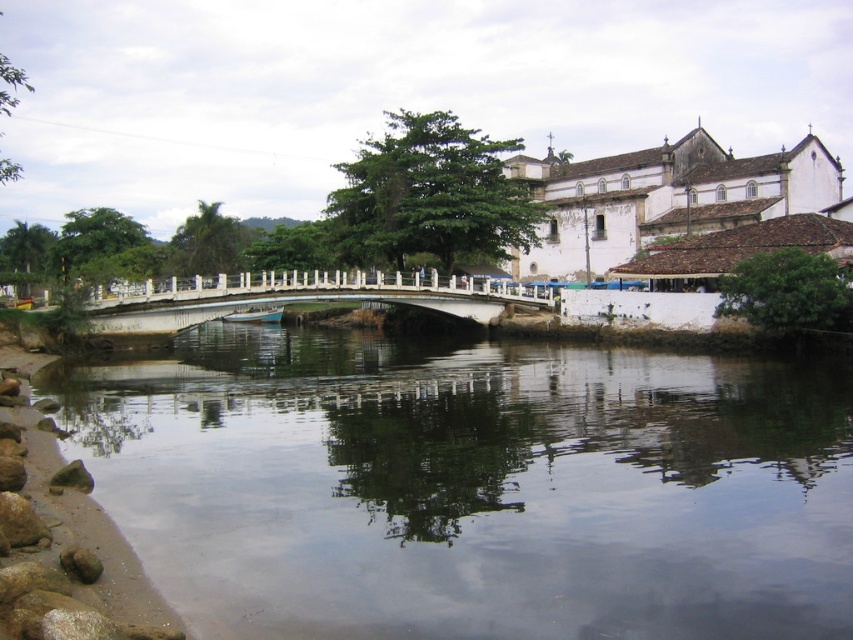
Describe the element at coordinates (473, 486) in the screenshot. I see `clear water at center` at that location.

Where is `clear water at center`? clear water at center is located at coordinates (473, 486).

Does white concrete bridge at center lie behind light blue wooden boat at center?

No, white concrete bridge at center is closer to the viewer.

Does white concrete bridge at center appear under light blue wooden boat at center?

No, white concrete bridge at center is not below light blue wooden boat at center.

I want to click on white concrete bridge at center, so click(297, 298).

Is clear water at center positioned before light blue wooden boat at center?

Yes, it is.

Is point (381, 496) positioned behind point (256, 314)?

That is False.

Is point (618, 452) farther from camera compared to point (257, 310)?

No, (618, 452) is in front of (257, 310).

I want to click on clear water at center, so click(473, 486).